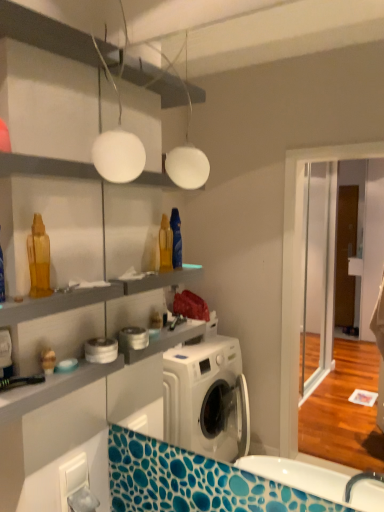
At what (x,y) coordinates should I click in order to perform the action: click on matte plastic toy at lower left. Please return your answer as a coordinate pair (x, y). The image size is (384, 512). Looking at the image, I should click on (48, 361).

Measure the distance between point (2, 154) and camera.

Point (2, 154) and camera are 83.60 centimeters apart.

I want to click on matte plastic toy at lower left, so [x=48, y=361].

Does white matte globe at upper center have a larger size compared to white glossy shelf at upper center?

Actually, white matte globe at upper center might be smaller than white glossy shelf at upper center.

Is white matte globe at upper center placed right next to white glossy shelf at upper center?

white matte globe at upper center and white glossy shelf at upper center are clearly separated.

From the picture: Which object is positioned more to the right, white matte globe at upper center or white glossy shelf at upper center?

From the viewer's perspective, white matte globe at upper center appears more on the right side.

How different are the orientations of white matte globe at upper center and white glossy shelf at upper center in degrees?

Result: They differ by 0.513 degrees in their facing directions.

From a real-world perspective, is matte plastic toy at lower left below white glossy shelf at upper center?

Yes, from a real-world perspective, matte plastic toy at lower left is under white glossy shelf at upper center.

Is matte plastic toy at lower left taller or shorter than white glossy shelf at upper center?

Clearly, matte plastic toy at lower left is taller compared to white glossy shelf at upper center.

Does matte plastic toy at lower left come behind white glossy shelf at upper center?

Yes, matte plastic toy at lower left is further from the viewer.

Which of these two, matte plastic toy at lower left or white glossy shelf at upper center, is thinner?

Thinner between the two is matte plastic toy at lower left.

Considering the positions of point (52, 169) and point (45, 350), is point (52, 169) closer or farther from the camera than point (45, 350)?

Point (52, 169) appears to be closer to the viewer than point (45, 350).

From the image's perspective, which one is positioned lower, white glossy shelf at upper center or matte plastic toy at lower left?

matte plastic toy at lower left, from the image's perspective.

Image resolution: width=384 pixels, height=512 pixels. I want to click on shelf in front of the matte plastic toy at lower left, so click(x=45, y=167).

Is white glossy shelf at upper center taller or shorter than matte plastic toy at lower left?

Clearly, white glossy shelf at upper center is shorter compared to matte plastic toy at lower left.

How many degrees apart are the facing directions of white matte globe at upper center and matte plastic toy at lower left?

89.5 degrees separate the facing orientations of white matte globe at upper center and matte plastic toy at lower left.

Looking at this image, which object is thinner, white matte globe at upper center or matte plastic toy at lower left?

With smaller width is matte plastic toy at lower left.

From the image's perspective, which one is positioned higher, white matte globe at upper center or matte plastic toy at lower left?

white matte globe at upper center.

Identify the location of light fixture located on the right of matte plastic toy at lower left. This screenshot has height=512, width=384. (117, 146).

Is there a large distance between white glossy shelf at upper center and white matte globe at upper center?

That's not correct — white glossy shelf at upper center is a little close to white matte globe at upper center.

Locate an element on the screen. The image size is (384, 512). shelf below the white matte globe at upper center (from the image's perspective) is located at coordinates (45, 167).

Is white matte globe at upper center at the back of white glossy shelf at upper center?

No, white glossy shelf at upper center's orientation is not away from white matte globe at upper center.

Is point (45, 368) more distant than point (107, 174)?

Yes.

From the picture: From the image's perspective, which one is positioned lower, matte plastic toy at lower left or white matte globe at upper center?

From the image's view, matte plastic toy at lower left is below.

Is matte plastic toy at lower left wider than white matte globe at upper center?

In fact, matte plastic toy at lower left might be narrower than white matte globe at upper center.

Identify the location of light fixture above the white glossy shelf at upper center (from the image's perspective). pos(117,146).

At what (x,y) coordinates should I click in order to perform the action: click on toy located behind the white glossy shelf at upper center. Please return your answer as a coordinate pair (x, y). The width and height of the screenshot is (384, 512). Looking at the image, I should click on (48, 361).

Based on their spatial positions, is matte plastic toy at lower left or white matte globe at upper center closer to white glossy shelf at upper center?

white matte globe at upper center is positioned closer to the anchor white glossy shelf at upper center.

Which object lies further to the anchor point white matte globe at upper center, white glossy shelf at upper center or matte plastic toy at lower left?

matte plastic toy at lower left is further to white matte globe at upper center.

From the image, which object appears to be farther from white matte globe at upper center, matte plastic toy at lower left or white glossy shelf at upper center?

matte plastic toy at lower left.

From the picture: Which object lies further to the anchor point matte plastic toy at lower left, white glossy shelf at upper center or white matte globe at upper center?

white matte globe at upper center lies further to matte plastic toy at lower left than the other object.

Considering their positions, is white matte globe at upper center positioned further to white glossy shelf at upper center than matte plastic toy at lower left?

matte plastic toy at lower left is further to white glossy shelf at upper center.

From the image, which object appears to be nearer to matte plastic toy at lower left, white matte globe at upper center or white glossy shelf at upper center?

white glossy shelf at upper center.

You are a GUI agent. You are given a task and a screenshot of the screen. Output one action in this format:
    pyautogui.click(x=<x>, y=<y>)
    Task: Click on the shelf between white matte globe at upper center and matte plastic toy at lower left vertically
    
    Given the screenshot: What is the action you would take?
    pyautogui.click(x=45, y=167)